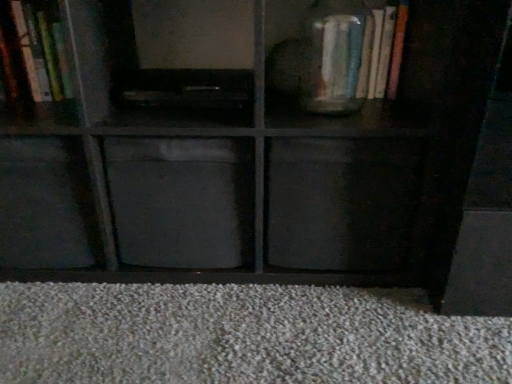
Identify the location of empty space that is ontop of matte black cube at lower left, marked as the 2th cabinet in a left-to-right arrangement (from a real-world perspective). This screenshot has width=512, height=384. (35, 117).